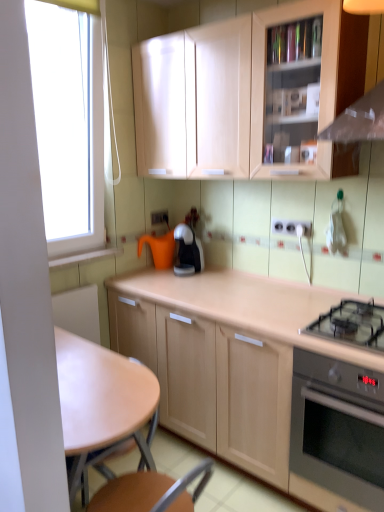
Question: Is white plastic electrical outlet at center, which is the 1th electric outlet in bottom-to-top order, a part of light wood cabinet at center, acting as the 1th cabinetry starting from the bottom?

Choices:
 (A) no
 (B) yes

Answer: (A)

Question: Does light wood cabinet at center, acting as the 1th cabinetry starting from the bottom, have a lesser height compared to white plastic electrical outlet at center, which appears as the 1th electric outlet when viewed from the right?

Choices:
 (A) yes
 (B) no

Answer: (B)

Question: Is light wood cabinet at center, acting as the 1th cabinetry starting from the bottom, next to white plastic electrical outlet at center, which is counted as the first electric outlet, starting from the front, and touching it?

Choices:
 (A) no
 (B) yes

Answer: (A)

Question: Does light wood cabinet at center, acting as the 1th cabinetry starting from the bottom, have a smaller size compared to white plastic electrical outlet at center, marked as the second electric outlet in a back-to-front arrangement?

Choices:
 (A) yes
 (B) no

Answer: (B)

Question: Can you confirm if light wood cabinet at center, acting as the 1th cabinetry starting from the bottom, is wider than white plastic electrical outlet at center, which is the 1th electric outlet in bottom-to-top order?

Choices:
 (A) yes
 (B) no

Answer: (A)

Question: Considering the relative positions of light wood cabinet at center, acting as the 2th cabinetry starting from the top, and white plastic electrical outlet at center, marked as the second electric outlet in a back-to-front arrangement, in the image provided, is light wood cabinet at center, acting as the 2th cabinetry starting from the top, to the left of white plastic electrical outlet at center, marked as the second electric outlet in a back-to-front arrangement, from the viewer's perspective?

Choices:
 (A) yes
 (B) no

Answer: (A)

Question: Does stainless steel oven at lower right have a smaller size compared to matte wood cabinet at upper center, placed as the 1th cabinetry when sorted from top to bottom?

Choices:
 (A) no
 (B) yes

Answer: (B)

Question: Is stainless steel oven at lower right to the right of matte wood cabinet at upper center, placed as the 2th cabinetry when sorted from bottom to top, from the viewer's perspective?

Choices:
 (A) no
 (B) yes

Answer: (B)

Question: Considering the relative sizes of stainless steel oven at lower right and matte wood cabinet at upper center, placed as the 1th cabinetry when sorted from top to bottom, in the image provided, is stainless steel oven at lower right wider than matte wood cabinet at upper center, placed as the 1th cabinetry when sorted from top to bottom,?

Choices:
 (A) yes
 (B) no

Answer: (A)

Question: Is the surface of stainless steel oven at lower right in direct contact with matte wood cabinet at upper center, placed as the 2th cabinetry when sorted from bottom to top?

Choices:
 (A) yes
 (B) no

Answer: (B)

Question: From a real-world perspective, is stainless steel oven at lower right over matte wood cabinet at upper center, placed as the 1th cabinetry when sorted from top to bottom?

Choices:
 (A) yes
 (B) no

Answer: (B)

Question: Does stainless steel oven at lower right have a lesser height compared to matte wood cabinet at upper center, placed as the 2th cabinetry when sorted from bottom to top?

Choices:
 (A) yes
 (B) no

Answer: (B)

Question: Can you confirm if light brown wooden table at center is smaller than black glass gas stove at lower right?

Choices:
 (A) yes
 (B) no

Answer: (B)